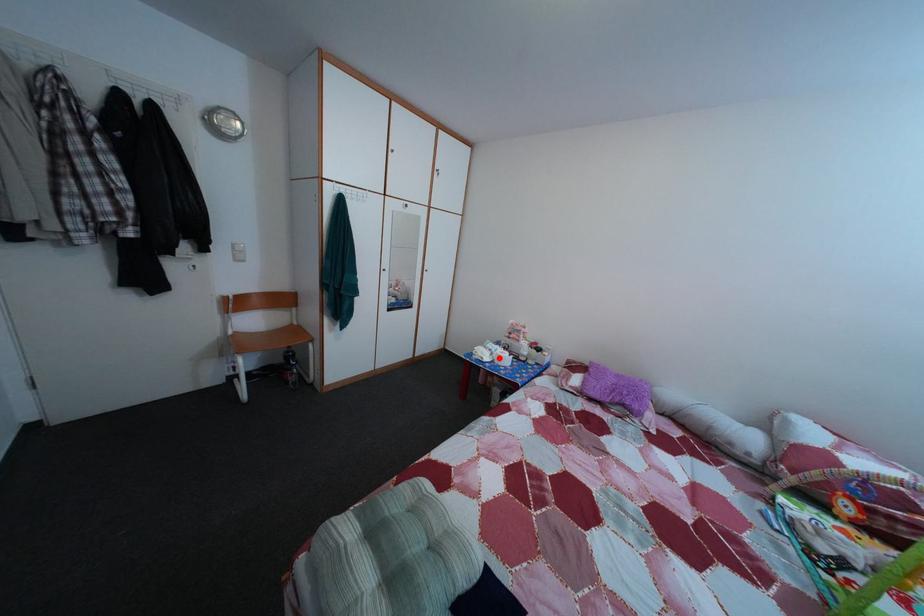
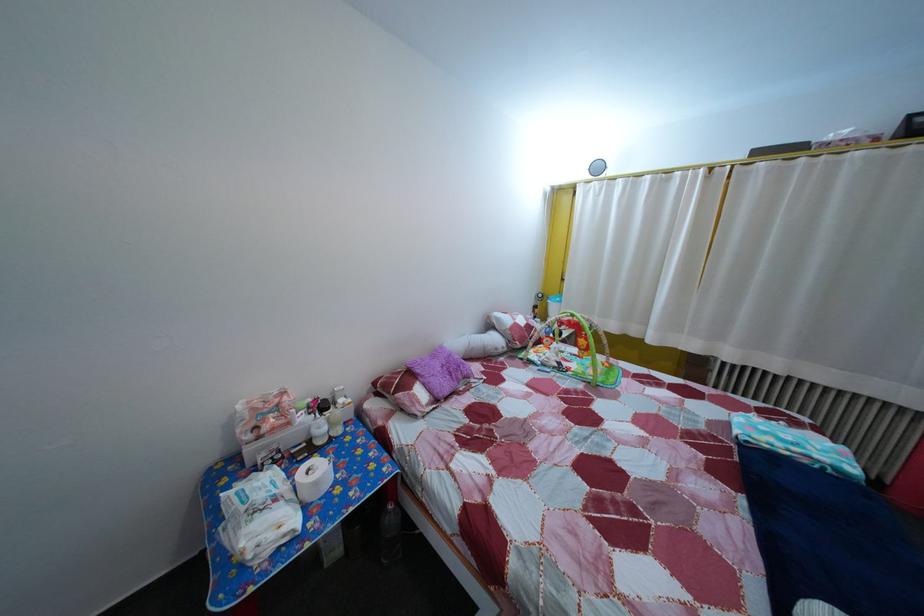
Where in the second image is the point corresponding to the highlighted location from the first image?

(285, 508)